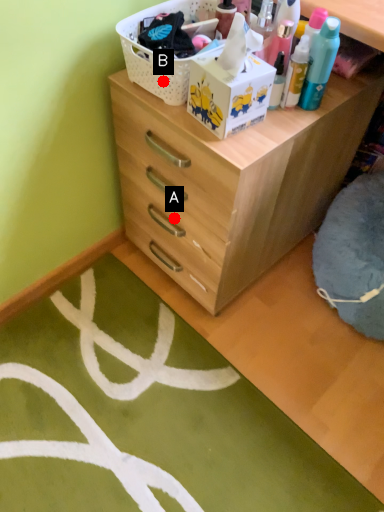
Question: Two points are circled on the image, labeled by A and B beside each circle. Which point is farther from the camera taking this photo?

Choices:
 (A) A is further
 (B) B is further

Answer: (A)